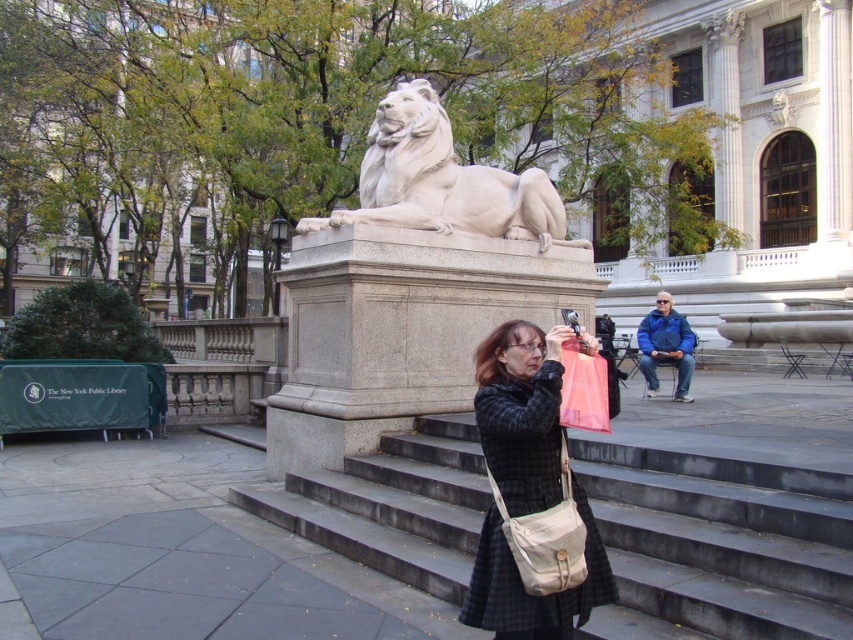
You are a photographer trying to capture a photo of the statue of the reclining lion. You notice two people nearby wearing a matte black coat at center and a blue fleece jacket at lower right. Which person is positioned closer to the left side of the statue?

The matte black coat at center is positioned to the left of the blue fleece jacket at lower right, so the person wearing the matte black coat at center is closer to the left side of the statue.

You are a tourist visiting the statue and want to take a photo of the white marble lion at center from a lower angle. To do this, you need to stand on the smooth concrete stairs at center. Is the stairs a suitable place to stand for this purpose?

The smooth concrete stairs at center is positioned under the white marble lion at center, so standing on the stairs would allow you to look up at the lion from a lower angle for the photo.

You are a photographer wanting to capture both the matte black coat at center and the white marble lion at center in the same frame. Given that your camera has a maximum focus range of 5 meters, will you be able to include both subjects in a single focused shot?

The matte black coat at center and white marble lion at center are 5.36 meters apart. Since the distance between them exceeds the camera maximum focus range of 5 meters, you cannot include both subjects in a single focused shot.